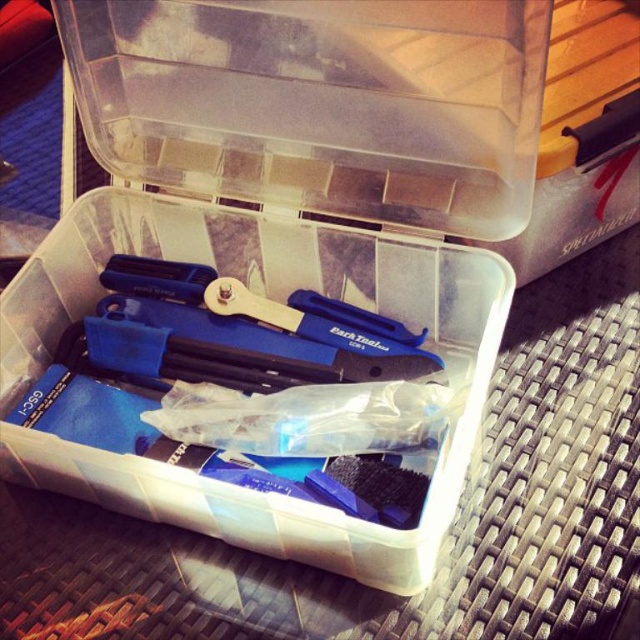
You are organizing a tool kit and need to place the transparent plastic tools at center into the transparent plastic container at center. Given that the tools are currently 7.41 inches away from the container, can you estimate whether they can be placed into the container without moving the container?

The transparent plastic tools at center are 7.41 inches away from the transparent plastic container at center. Since the tools need to be moved to the container, the distance between them means you would need to move the tools approximately 7.41 inches to place them inside the container. However, the question specifies not moving the container, so unless the tools can be moved that distance, they cannot be placed into the container without moving either the tools or the container.

You have a small item that needs to fit into either the transparent plastic container at center or the transparent plastic tools at center. Which one has a larger width to accommodate the item?

The transparent plastic container at center might be wider than transparent plastic tools at center, so it could accommodate the item better.